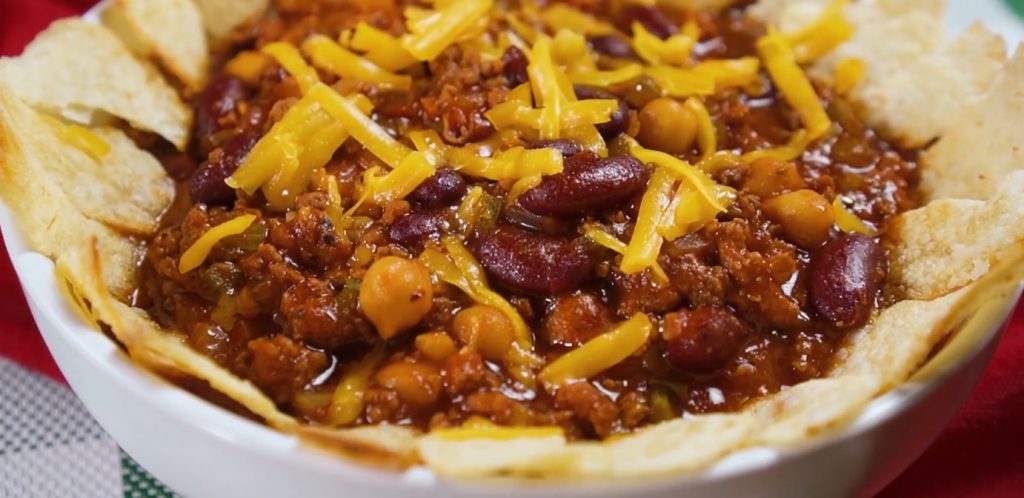
Image resolution: width=1024 pixels, height=498 pixels. What are the coordinates of `reflection from window` in the screenshot? It's located at (717, 396), (814, 156), (860, 204).